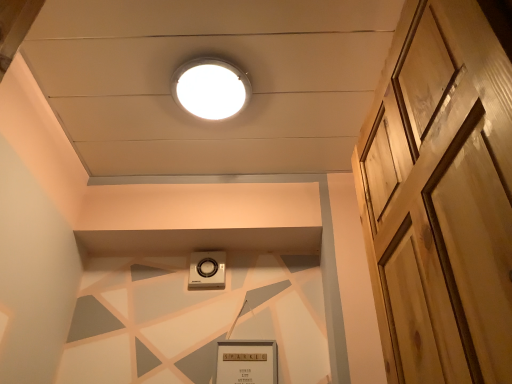
The image size is (512, 384). Describe the element at coordinates (210, 88) in the screenshot. I see `white glossy droplight at upper center` at that location.

Where is `light brown wooden door at right`? light brown wooden door at right is located at coordinates (442, 194).

Does light brown wooden door at right come behind white glossy droplight at upper center?

No, light brown wooden door at right is closer to the camera.

Is light brown wooden door at right outside of white glossy droplight at upper center?

Yes.

Considering the sizes of objects light brown wooden door at right and white glossy droplight at upper center in the image provided, who is shorter, light brown wooden door at right or white glossy droplight at upper center?

Standing shorter between the two is white glossy droplight at upper center.

Is white glossy droplight at upper center placed right next to white plastic thermostat at center?

There is a gap between white glossy droplight at upper center and white plastic thermostat at center.

From a real-world perspective, is white glossy droplight at upper center above or below white plastic thermostat at center?

From a real-world perspective, white glossy droplight at upper center is physically above white plastic thermostat at center.

Which is more to the left, white glossy droplight at upper center or white plastic thermostat at center?

From the viewer's perspective, white plastic thermostat at center appears more on the left side.

Considering the sizes of white glossy droplight at upper center and white plastic thermostat at center in the image, is white glossy droplight at upper center bigger or smaller than white plastic thermostat at center?

white glossy droplight at upper center is bigger than white plastic thermostat at center.

Locate an element on the screen. Image resolution: width=512 pixels, height=384 pixels. thermostat that is on the left side of light brown wooden door at right is located at coordinates (207, 270).

Is white plastic thermostat at center next to light brown wooden door at right?

No, white plastic thermostat at center is not in contact with light brown wooden door at right.

Based on the photo, considering the relative positions of white plastic thermostat at center and light brown wooden door at right in the image provided, is white plastic thermostat at center in front of light brown wooden door at right?

No, white plastic thermostat at center is behind light brown wooden door at right.

Can you confirm if white plastic thermostat at center is smaller than light brown wooden door at right?

Yes.

From a real-world perspective, relative to white glossy droplight at upper center, is white plastic thermostat at center vertically above or below?

Clearly, from a real-world perspective, white plastic thermostat at center is below white glossy droplight at upper center.

Is white plastic thermostat at center not near white glossy droplight at upper center?

No, there isn't a large distance between white plastic thermostat at center and white glossy droplight at upper center.

Is white plastic thermostat at center aimed at white glossy droplight at upper center?

No, white plastic thermostat at center does not turn towards white glossy droplight at upper center.

How much distance is there between white plastic thermostat at center and white glossy droplight at upper center?

The distance of white plastic thermostat at center from white glossy droplight at upper center is 77.37 centimeters.

Could you tell me if light brown wooden door at right is turned towards white plastic thermostat at center?

No, light brown wooden door at right does not turn towards white plastic thermostat at center.

From the picture: From a real-world perspective, is light brown wooden door at right above or below white plastic thermostat at center?

Clearly, from a real-world perspective, light brown wooden door at right is below white plastic thermostat at center.

Is point (377, 263) in front of point (200, 280)?

Yes, point (377, 263) is in front of point (200, 280).

Is white glossy droplight at upper center inside or outside of light brown wooden door at right?

white glossy droplight at upper center is not inside light brown wooden door at right, it's outside.

Between white glossy droplight at upper center and light brown wooden door at right, which one has smaller size?

Smaller between the two is white glossy droplight at upper center.

In the image, is white glossy droplight at upper center positioned in front of or behind light brown wooden door at right?

Clearly, white glossy droplight at upper center is behind light brown wooden door at right.

Find the location of a particular element. This screenshot has width=512, height=384. droplight that appears above the light brown wooden door at right (from the image's perspective) is located at coordinates (210, 88).

Identify the location of thermostat located below the white glossy droplight at upper center (from the image's perspective). The height and width of the screenshot is (384, 512). (207, 270).

From the picture: Considering their positions, is white plastic thermostat at center positioned further to light brown wooden door at right than white glossy droplight at upper center?

white plastic thermostat at center is positioned further to the anchor light brown wooden door at right.

Which object lies nearer to the anchor point white plastic thermostat at center, light brown wooden door at right or white glossy droplight at upper center?

white glossy droplight at upper center is closer to white plastic thermostat at center.

Based on their spatial positions, is white glossy droplight at upper center or light brown wooden door at right further from white plastic thermostat at center?

light brown wooden door at right lies further to white plastic thermostat at center than the other object.

Considering their positions, is white glossy droplight at upper center positioned further to light brown wooden door at right than white plastic thermostat at center?

white plastic thermostat at center.

When comparing their distances from white glossy droplight at upper center, does white plastic thermostat at center or light brown wooden door at right seem further?

light brown wooden door at right lies further to white glossy droplight at upper center than the other object.

From the image, which object appears to be nearer to white glossy droplight at upper center, light brown wooden door at right or white plastic thermostat at center?

Based on the image, white plastic thermostat at center appears to be nearer to white glossy droplight at upper center.

Find the location of `droplight located between light brown wooden door at right and white plastic thermostat at center in the depth direction`. droplight located between light brown wooden door at right and white plastic thermostat at center in the depth direction is located at coordinates (210, 88).